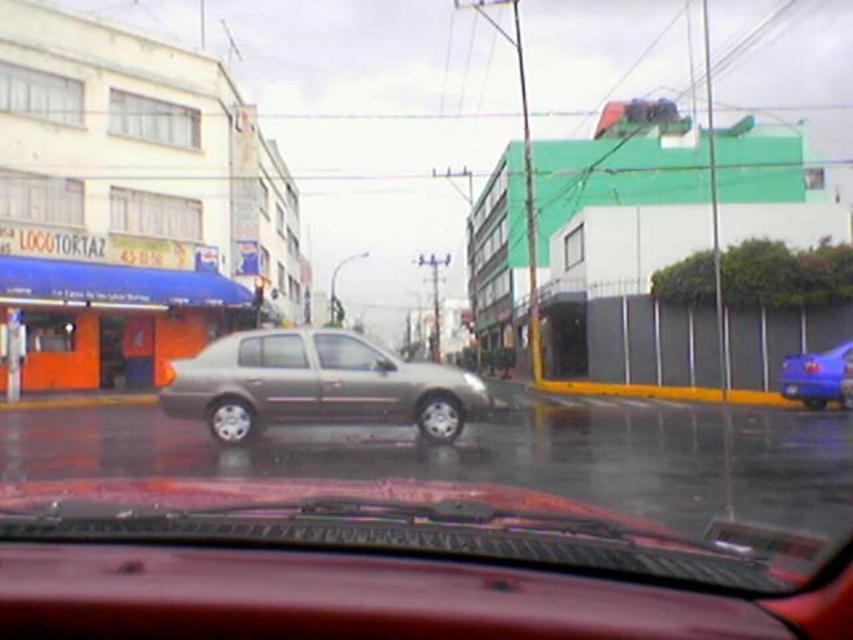
Question: Considering the real-world distances, which object is closest to the blue metallic van at right?

Choices:
 (A) blue plastic license plate at center
 (B) satin silver car window at center
 (C) satin silver sedan at center
 (D) satin silver window at center

Answer: (A)

Question: Estimate the real-world distances between objects in this image. Which object is closer to the blue metallic van at right?

Choices:
 (A) satin silver window at center
 (B) satin silver sedan at center
 (C) satin silver car window at center
 (D) blue plastic license plate at center

Answer: (D)

Question: Which point is farther to the camera?

Choices:
 (A) satin silver window at center
 (B) satin silver sedan at center
 (C) satin silver car window at center
 (D) blue plastic license plate at center

Answer: (D)

Question: Does blue metallic van at right have a smaller size compared to satin silver window at center?

Choices:
 (A) yes
 (B) no

Answer: (B)

Question: Is blue metallic van at right below satin silver car window at center?

Choices:
 (A) no
 (B) yes

Answer: (B)

Question: Does satin silver sedan at center have a greater width compared to satin silver car window at center?

Choices:
 (A) no
 (B) yes

Answer: (B)